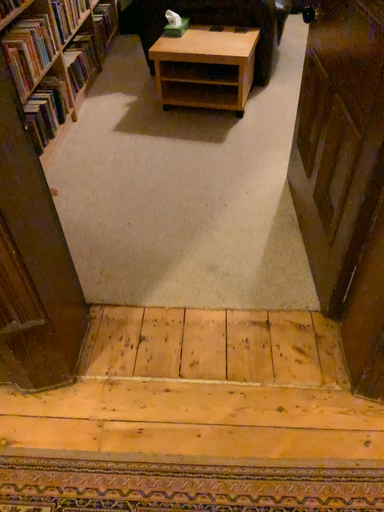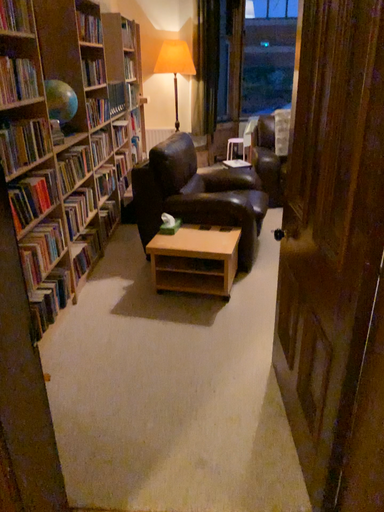
Question: Which way did the camera rotate in the video?

Choices:
 (A) rotated downward
 (B) rotated upward

Answer: (B)